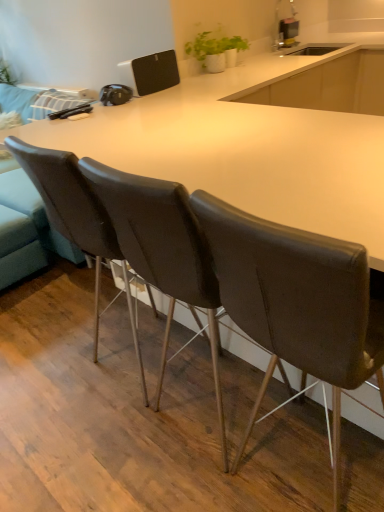
Question: From the image's perspective, is white matte pot at upper center over leather at center, the 2th chair positioned from the right?

Choices:
 (A) no
 (B) yes

Answer: (B)

Question: Would you say white matte pot at upper center is outside leather at center, the 2th chair positioned from the right?

Choices:
 (A) no
 (B) yes

Answer: (B)

Question: Is white matte pot at upper center behind leather at center, the 2th chair positioned from the right?

Choices:
 (A) yes
 (B) no

Answer: (A)

Question: Considering the relative sizes of white matte pot at upper center and leather at center, the 2th chair positioned from the right, in the image provided, is white matte pot at upper center thinner than leather at center, the 2th chair positioned from the right,?

Choices:
 (A) yes
 (B) no

Answer: (A)

Question: Does white matte pot at upper center have a greater width compared to leather at center, the 2th chair in the left-to-right sequence?

Choices:
 (A) yes
 (B) no

Answer: (B)

Question: In the image, is brown leather chair at center, which is counted as the first chair, starting from the right, positioned in front of or behind metallic silver toaster at upper center?

Choices:
 (A) front
 (B) behind

Answer: (A)

Question: Is brown leather chair at center, which is counted as the first chair, starting from the right, to the left or to the right of metallic silver toaster at upper center in the image?

Choices:
 (A) left
 (B) right

Answer: (A)

Question: Does point (210, 233) appear closer or farther from the camera than point (281, 26)?

Choices:
 (A) farther
 (B) closer

Answer: (B)

Question: Do you think brown leather chair at center, arranged as the 3th chair when viewed from the left, is within metallic silver toaster at upper center, or outside of it?

Choices:
 (A) inside
 (B) outside

Answer: (B)

Question: From the image's perspective, is brown leather chair at center, arranged as the 3th chair when viewed from the left, above or below white matte pot at upper center?

Choices:
 (A) below
 (B) above

Answer: (A)

Question: In the image, is brown leather chair at center, arranged as the 3th chair when viewed from the left, positioned in front of or behind white matte pot at upper center?

Choices:
 (A) front
 (B) behind

Answer: (A)

Question: In terms of size, does brown leather chair at center, arranged as the 3th chair when viewed from the left, appear bigger or smaller than white matte pot at upper center?

Choices:
 (A) big
 (B) small

Answer: (A)

Question: Considering the positions of brown leather chair at center, arranged as the 3th chair when viewed from the left, and white matte pot at upper center in the image, is brown leather chair at center, arranged as the 3th chair when viewed from the left, wider or thinner than white matte pot at upper center?

Choices:
 (A) thin
 (B) wide

Answer: (B)

Question: Would you say leather at left, which appears as the 1th chair when viewed from the left, is to the left or to the right of white matte pot at upper center in the picture?

Choices:
 (A) left
 (B) right

Answer: (A)

Question: Looking at the image, does leather at left, the 3th chair when ordered from right to left, seem bigger or smaller compared to white matte pot at upper center?

Choices:
 (A) big
 (B) small

Answer: (A)